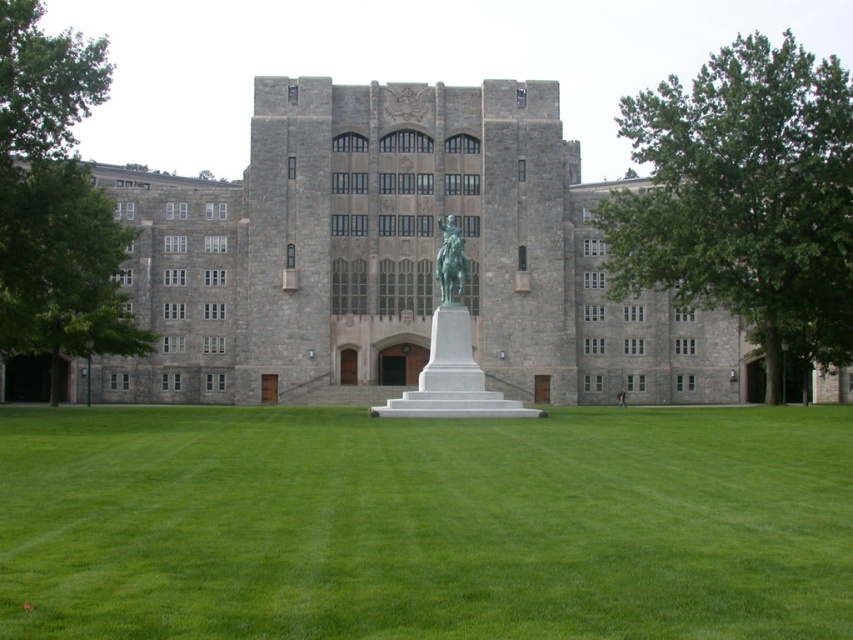
You are a gardener who needs to mow the lawn. You see the green grass at center and the bronze statue at center. Which one is taller?

The bronze statue at center is taller than the green grass at center.

You are a visitor at the university campus and want to take a photo of the statue on horseback. You want to frame the statue with the green grass at center and the green leafy tree at right in the background. Which object should be closer to the camera to achieve this composition?

To frame the statue with the green grass at center and the green leafy tree at right in the background, the green grass at center should be closer to the camera since it is positioned to the left of the green leafy tree at right, allowing both to be captured with the grass in the foreground and the tree in the background.